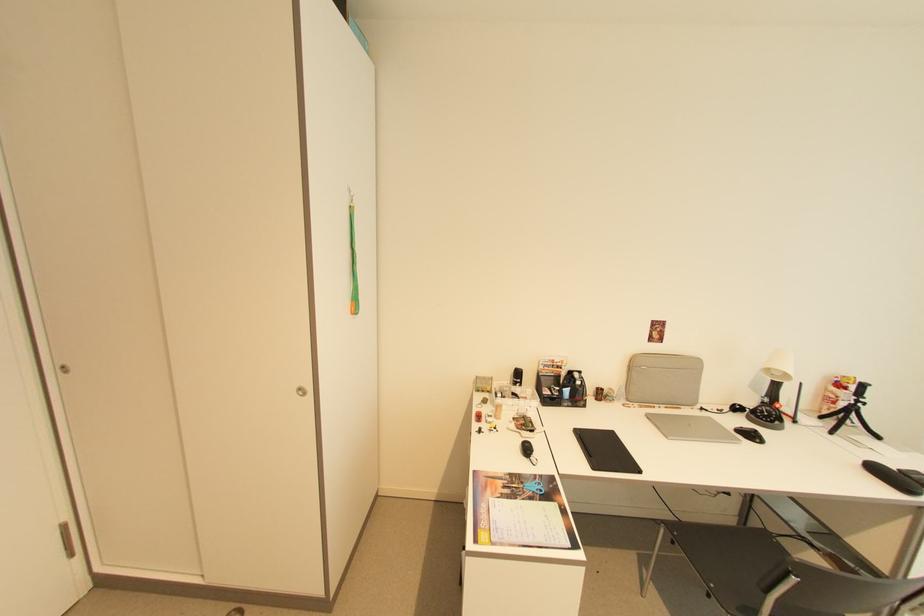
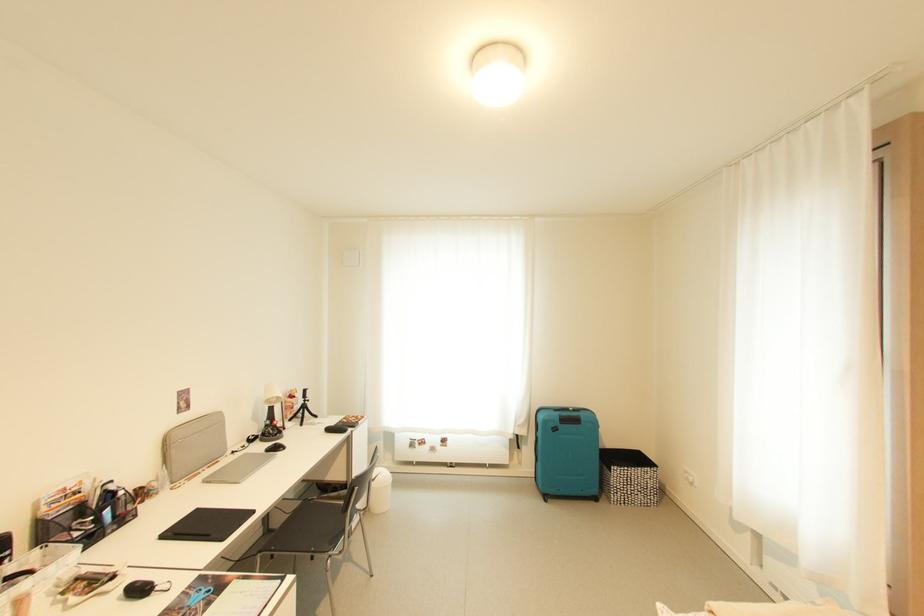
Where in the second image is the point corresponding to (545,477) from the first image?

(195, 589)